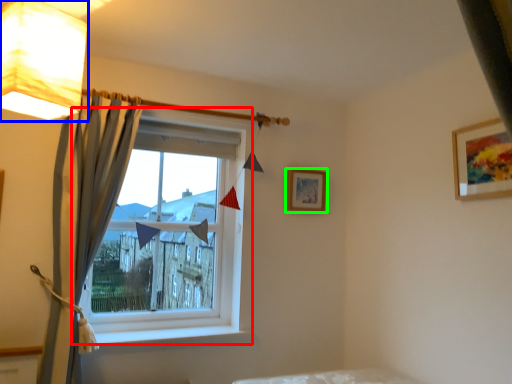
Question: Considering the real-world distances, which object is farthest from window (highlighted by a red box)? lamp (highlighted by a blue box) or picture frame (highlighted by a green box)?

Choices:
 (A) lamp
 (B) picture frame

Answer: (A)